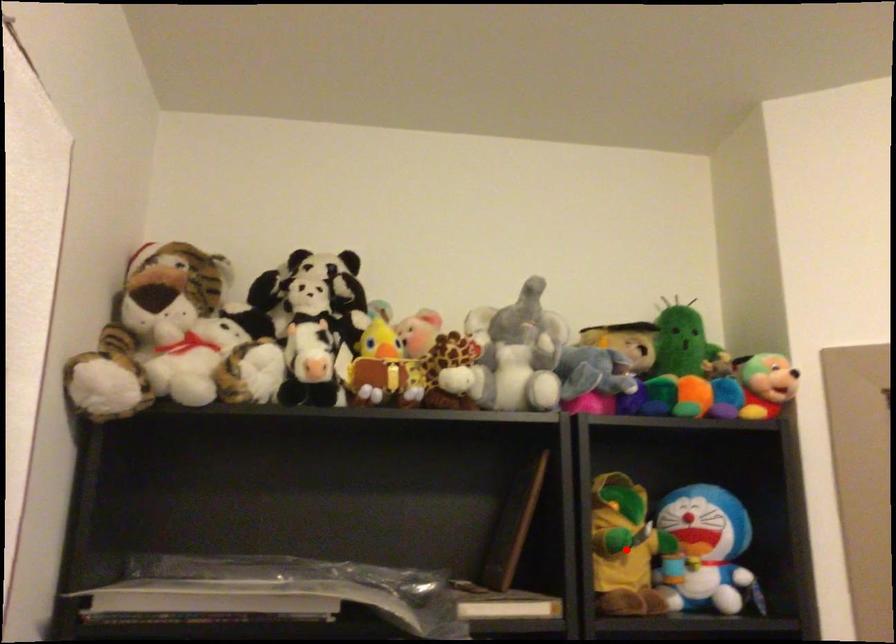
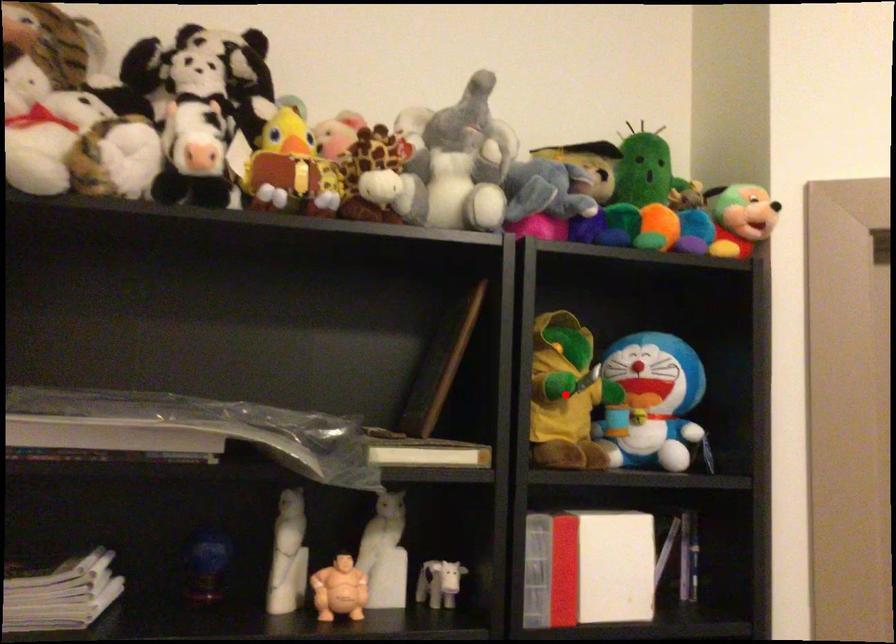
I am providing you with two images of the same scene from different viewpoints. A red point is marked on the first image and another point is marked on the second image. Do the highlighted points in image1 and image2 indicate the same real-world spot?

Yes